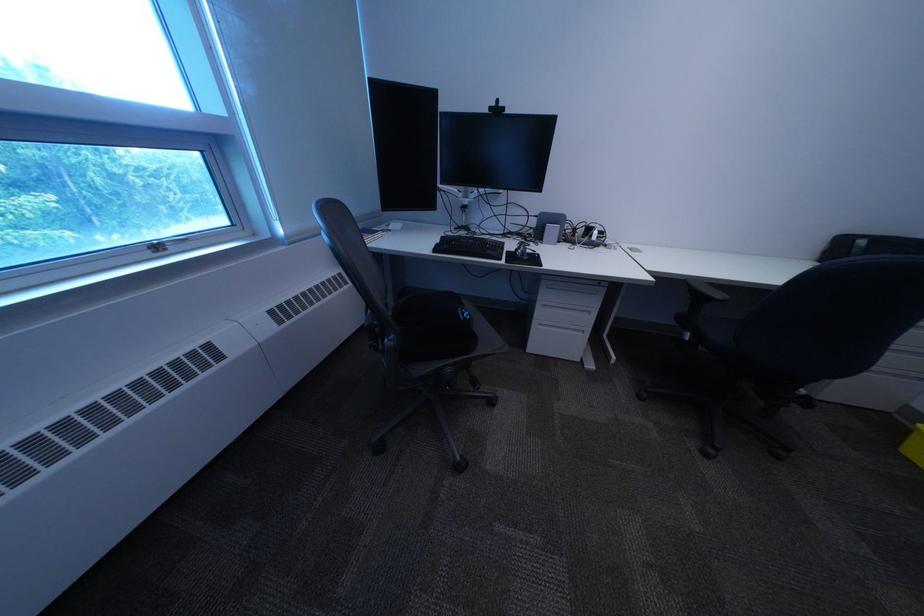
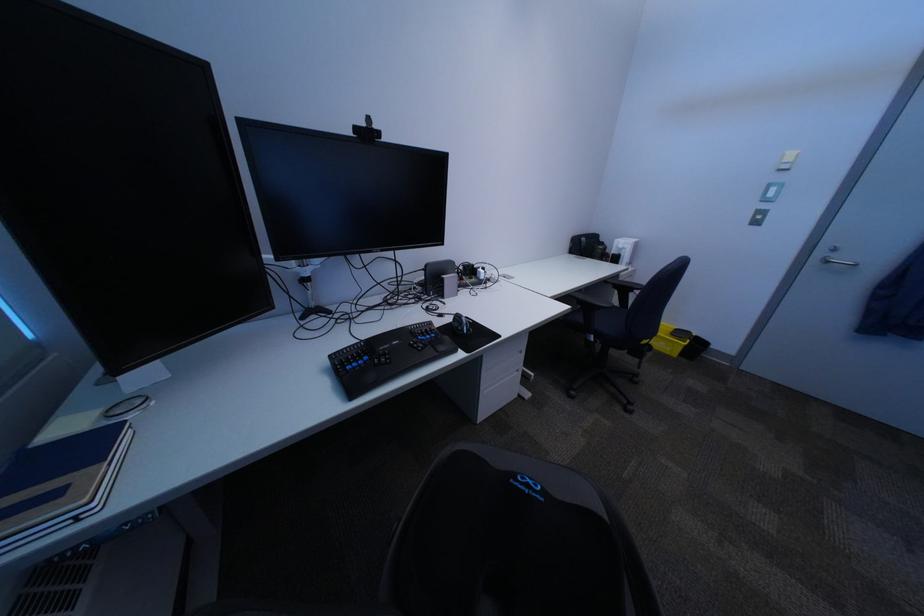
Question: The camera is either moving clockwise (left) or counter-clockwise (right) around the object. The first image is from the beginning of the video and the second image is from the end. Is the camera moving left or right when shooting the video?

Choices:
 (A) Left
 (B) Right

Answer: (A)